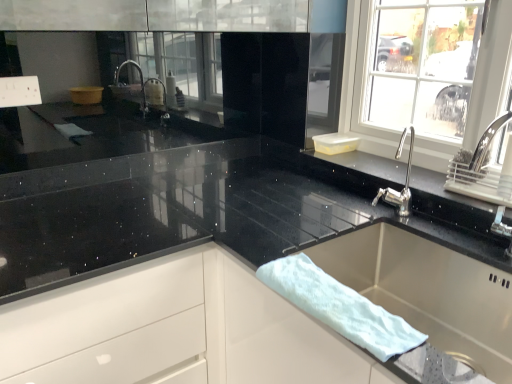
Question: Can you confirm if stainless steel sink at lower right is positioned to the right of white glossy drawer at center?

Choices:
 (A) no
 (B) yes

Answer: (B)

Question: Considering the relative sizes of stainless steel sink at lower right and white glossy drawer at center in the image provided, is stainless steel sink at lower right bigger than white glossy drawer at center?

Choices:
 (A) no
 (B) yes

Answer: (A)

Question: Considering the relative sizes of stainless steel sink at lower right and white glossy drawer at center in the image provided, is stainless steel sink at lower right wider than white glossy drawer at center?

Choices:
 (A) no
 (B) yes

Answer: (A)

Question: Is stainless steel sink at lower right positioned far away from white glossy drawer at center?

Choices:
 (A) yes
 (B) no

Answer: (B)

Question: From the image's perspective, is stainless steel sink at lower right above white glossy drawer at center?

Choices:
 (A) yes
 (B) no

Answer: (A)

Question: Considering the positions of point 285,261 and point 394,228, is point 285,261 closer or farther from the camera than point 394,228?

Choices:
 (A) closer
 (B) farther

Answer: (A)

Question: Looking at the image, does white fluffy bath towel at sink seem bigger or smaller compared to stainless steel sink at lower right?

Choices:
 (A) small
 (B) big

Answer: (A)

Question: From a real-world perspective, is white fluffy bath towel at sink physically located above or below stainless steel sink at lower right?

Choices:
 (A) above
 (B) below

Answer: (A)

Question: From the image's perspective, relative to stainless steel sink at lower right, is white fluffy bath towel at sink above or below?

Choices:
 (A) above
 (B) below

Answer: (A)

Question: In terms of height, does white glossy drawer at center look taller or shorter compared to white fluffy bath towel at sink?

Choices:
 (A) tall
 (B) short

Answer: (A)

Question: Is white glossy drawer at center situated inside white fluffy bath towel at sink or outside?

Choices:
 (A) outside
 (B) inside

Answer: (A)

Question: Considering the positions of point (123, 369) and point (372, 324), is point (123, 369) closer or farther from the camera than point (372, 324)?

Choices:
 (A) closer
 (B) farther

Answer: (B)

Question: Considering the positions of white glossy drawer at center and white fluffy bath towel at sink in the image, is white glossy drawer at center wider or thinner than white fluffy bath towel at sink?

Choices:
 (A) thin
 (B) wide

Answer: (B)

Question: Looking at their shapes, would you say white fluffy bath towel at sink is wider or thinner than white glossy drawer at center?

Choices:
 (A) thin
 (B) wide

Answer: (A)

Question: Which is correct: white fluffy bath towel at sink is inside white glossy drawer at center, or outside of it?

Choices:
 (A) inside
 (B) outside

Answer: (B)